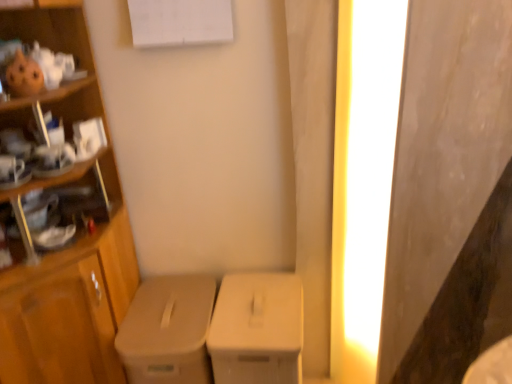
Identify the location of wooden cabinet at left. (69, 280).

This screenshot has width=512, height=384. Describe the element at coordinates (168, 330) in the screenshot. I see `matte beige cardboard box at center, arranged as the second cardboard box when viewed from the right` at that location.

Find the location of a particular element. The width and height of the screenshot is (512, 384). white matte cardboard box at center, the 1th cardboard box positioned from the right is located at coordinates (257, 329).

Is wooden cabinet at left at the left side of matte beige cardboard box at center, arranged as the second cardboard box when viewed from the right?

Indeed, wooden cabinet at left is positioned on the left side of matte beige cardboard box at center, arranged as the second cardboard box when viewed from the right.

Identify the location of cabinetry located in front of the matte beige cardboard box at center, arranged as the second cardboard box when viewed from the right. This screenshot has width=512, height=384. (69, 280).

Relative to matte beige cardboard box at center, arranged as the second cardboard box when viewed from the right, is wooden cabinet at left in front or behind?

In the image, wooden cabinet at left appears in front of matte beige cardboard box at center, arranged as the second cardboard box when viewed from the right.

Looking at this image, is wooden cabinet at left oriented away from matte beige cardboard box at center, which appears as the first cardboard box when viewed from the left?

That's not correct — wooden cabinet at left is not looking away from matte beige cardboard box at center, which appears as the first cardboard box when viewed from the left.

Is bright yellow light at right looking in the opposite direction of matte beige cardboard box at center, arranged as the second cardboard box when viewed from the right?

No, matte beige cardboard box at center, arranged as the second cardboard box when viewed from the right, is not at the back of bright yellow light at right.

Is matte beige cardboard box at center, arranged as the second cardboard box when viewed from the right, inside bright yellow light at right?

Definitely not — matte beige cardboard box at center, arranged as the second cardboard box when viewed from the right, is not inside bright yellow light at right.

Which object is closer to the camera taking this photo, bright yellow light at right or matte beige cardboard box at center, arranged as the second cardboard box when viewed from the right?

bright yellow light at right is closer to the camera.

Based on their positions, is bright yellow light at right located to the left or right of matte beige cardboard box at center, which appears as the first cardboard box when viewed from the left?

bright yellow light at right is positioned on matte beige cardboard box at center, which appears as the first cardboard box when viewed from the left,'s right side.

Is matte beige cardboard box at center, which appears as the first cardboard box when viewed from the left, oriented away from wooden cabinet at left?

matte beige cardboard box at center, which appears as the first cardboard box when viewed from the left, does not have its back to wooden cabinet at left.

From a real-world perspective, between matte beige cardboard box at center, arranged as the second cardboard box when viewed from the right, and wooden cabinet at left, who is vertically higher?

From a 3D spatial view, wooden cabinet at left is above.

Is matte beige cardboard box at center, which appears as the first cardboard box when viewed from the left, bigger or smaller than wooden cabinet at left?

In the image, matte beige cardboard box at center, which appears as the first cardboard box when viewed from the left, appears to be smaller than wooden cabinet at left.

Considering the sizes of matte beige cardboard box at center, arranged as the second cardboard box when viewed from the right, and wooden cabinet at left in the image, is matte beige cardboard box at center, arranged as the second cardboard box when viewed from the right, wider or thinner than wooden cabinet at left?

In the image, matte beige cardboard box at center, arranged as the second cardboard box when viewed from the right, appears to be more narrow than wooden cabinet at left.

In terms of size, does matte beige cardboard box at center, arranged as the second cardboard box when viewed from the right, appear bigger or smaller than bright yellow light at right?

matte beige cardboard box at center, arranged as the second cardboard box when viewed from the right, is bigger than bright yellow light at right.

From a real-world perspective, relative to bright yellow light at right, is matte beige cardboard box at center, arranged as the second cardboard box when viewed from the right, vertically above or below?

In terms of real-world spatial position, matte beige cardboard box at center, arranged as the second cardboard box when viewed from the right, is below bright yellow light at right.

Is point (177, 355) closer or farther from the camera than point (340, 223)?

Clearly, point (177, 355) is closer to the camera than point (340, 223).

Considering the sizes of objects matte beige cardboard box at center, arranged as the second cardboard box when viewed from the right, and bright yellow light at right in the image provided, who is taller, matte beige cardboard box at center, arranged as the second cardboard box when viewed from the right, or bright yellow light at right?

bright yellow light at right is taller.

From a real-world perspective, who is located lower, white matte cardboard box at center, marked as the 2th cardboard box in a left-to-right arrangement, or matte beige cardboard box at center, arranged as the second cardboard box when viewed from the right?

In real-world perspective, white matte cardboard box at center, marked as the 2th cardboard box in a left-to-right arrangement, is lower.

The image size is (512, 384). In the image, there is a matte beige cardboard box at center, which appears as the first cardboard box when viewed from the left. Identify the location of cardboard box above it (from the image's perspective). (257, 329).

How far apart are white matte cardboard box at center, marked as the 2th cardboard box in a left-to-right arrangement, and matte beige cardboard box at center, arranged as the second cardboard box when viewed from the right?

A distance of 6.28 inches exists between white matte cardboard box at center, marked as the 2th cardboard box in a left-to-right arrangement, and matte beige cardboard box at center, arranged as the second cardboard box when viewed from the right.

Between white matte cardboard box at center, the 1th cardboard box positioned from the right, and matte beige cardboard box at center, which appears as the first cardboard box when viewed from the left, which one has smaller size?

white matte cardboard box at center, the 1th cardboard box positioned from the right.

Where is `lighting above the white matte cardboard box at center, marked as the 2th cardboard box in a left-to-right arrangement (from the image's perspective)`? lighting above the white matte cardboard box at center, marked as the 2th cardboard box in a left-to-right arrangement (from the image's perspective) is located at coordinates (362, 177).

From the image's perspective, which one is positioned lower, bright yellow light at right or white matte cardboard box at center, marked as the 2th cardboard box in a left-to-right arrangement?

white matte cardboard box at center, marked as the 2th cardboard box in a left-to-right arrangement, is shown below in the image.

Which is in front, point (366, 80) or point (244, 307)?

The point (366, 80) is closer to the camera.

From the image's perspective, which one is positioned higher, matte beige cardboard box at center, which appears as the first cardboard box when viewed from the left, or white matte cardboard box at center, the 1th cardboard box positioned from the right?

white matte cardboard box at center, the 1th cardboard box positioned from the right, is shown above in the image.

Is matte beige cardboard box at center, which appears as the first cardboard box when viewed from the left, not close to white matte cardboard box at center, marked as the 2th cardboard box in a left-to-right arrangement?

That's not correct — matte beige cardboard box at center, which appears as the first cardboard box when viewed from the left, is a little close to white matte cardboard box at center, marked as the 2th cardboard box in a left-to-right arrangement.

Does matte beige cardboard box at center, arranged as the second cardboard box when viewed from the right, have a greater width compared to white matte cardboard box at center, marked as the 2th cardboard box in a left-to-right arrangement?

Yes, matte beige cardboard box at center, arranged as the second cardboard box when viewed from the right, is wider than white matte cardboard box at center, marked as the 2th cardboard box in a left-to-right arrangement.

What's the angular difference between matte beige cardboard box at center, arranged as the second cardboard box when viewed from the right, and white matte cardboard box at center, the 1th cardboard box positioned from the right,'s facing directions?

The angular difference between matte beige cardboard box at center, arranged as the second cardboard box when viewed from the right, and white matte cardboard box at center, the 1th cardboard box positioned from the right, is 0.414 degrees.

Where is `cabinetry located above the matte beige cardboard box at center, which appears as the first cardboard box when viewed from the left (from a real-world perspective)`? This screenshot has width=512, height=384. cabinetry located above the matte beige cardboard box at center, which appears as the first cardboard box when viewed from the left (from a real-world perspective) is located at coordinates (69, 280).

Locate an element on the screen. This screenshot has width=512, height=384. lighting on the right side of matte beige cardboard box at center, arranged as the second cardboard box when viewed from the right is located at coordinates (362, 177).

Which object lies further to the anchor point wooden cabinet at left, matte beige cardboard box at center, arranged as the second cardboard box when viewed from the right, or white matte cardboard box at center, marked as the 2th cardboard box in a left-to-right arrangement?

white matte cardboard box at center, marked as the 2th cardboard box in a left-to-right arrangement.

When comparing their distances from wooden cabinet at left, does matte beige cardboard box at center, which appears as the first cardboard box when viewed from the left, or bright yellow light at right seem further?

Based on the image, bright yellow light at right appears to be further to wooden cabinet at left.

Considering their positions, is bright yellow light at right positioned closer to wooden cabinet at left than white matte cardboard box at center, marked as the 2th cardboard box in a left-to-right arrangement?

white matte cardboard box at center, marked as the 2th cardboard box in a left-to-right arrangement.

Which object lies nearer to the anchor point white matte cardboard box at center, the 1th cardboard box positioned from the right, matte beige cardboard box at center, which appears as the first cardboard box when viewed from the left, or wooden cabinet at left?

matte beige cardboard box at center, which appears as the first cardboard box when viewed from the left, is positioned closer to the anchor white matte cardboard box at center, the 1th cardboard box positioned from the right.

From the picture: Based on their spatial positions, is white matte cardboard box at center, the 1th cardboard box positioned from the right, or bright yellow light at right further from matte beige cardboard box at center, arranged as the second cardboard box when viewed from the right?

bright yellow light at right is positioned further to the anchor matte beige cardboard box at center, arranged as the second cardboard box when viewed from the right.

From the image, which object appears to be nearer to white matte cardboard box at center, marked as the 2th cardboard box in a left-to-right arrangement, bright yellow light at right or matte beige cardboard box at center, which appears as the first cardboard box when viewed from the left?

matte beige cardboard box at center, which appears as the first cardboard box when viewed from the left, is closer to white matte cardboard box at center, marked as the 2th cardboard box in a left-to-right arrangement.

Estimate the real-world distances between objects in this image. Which object is further from matte beige cardboard box at center, arranged as the second cardboard box when viewed from the right, wooden cabinet at left or white matte cardboard box at center, marked as the 2th cardboard box in a left-to-right arrangement?

wooden cabinet at left is positioned further to the anchor matte beige cardboard box at center, arranged as the second cardboard box when viewed from the right.

Looking at the image, which one is located closer to matte beige cardboard box at center, which appears as the first cardboard box when viewed from the left, white matte cardboard box at center, the 1th cardboard box positioned from the right, or wooden cabinet at left?

The object closer to matte beige cardboard box at center, which appears as the first cardboard box when viewed from the left, is white matte cardboard box at center, the 1th cardboard box positioned from the right.

At what (x,y) coordinates should I click in order to perform the action: click on cardboard box between matte beige cardboard box at center, arranged as the second cardboard box when viewed from the right, and bright yellow light at right from left to right. Please return your answer as a coordinate pair (x, y). Looking at the image, I should click on pos(257,329).

Identify the location of cardboard box located between wooden cabinet at left and white matte cardboard box at center, marked as the 2th cardboard box in a left-to-right arrangement, in the left-right direction. The width and height of the screenshot is (512, 384). click(168, 330).